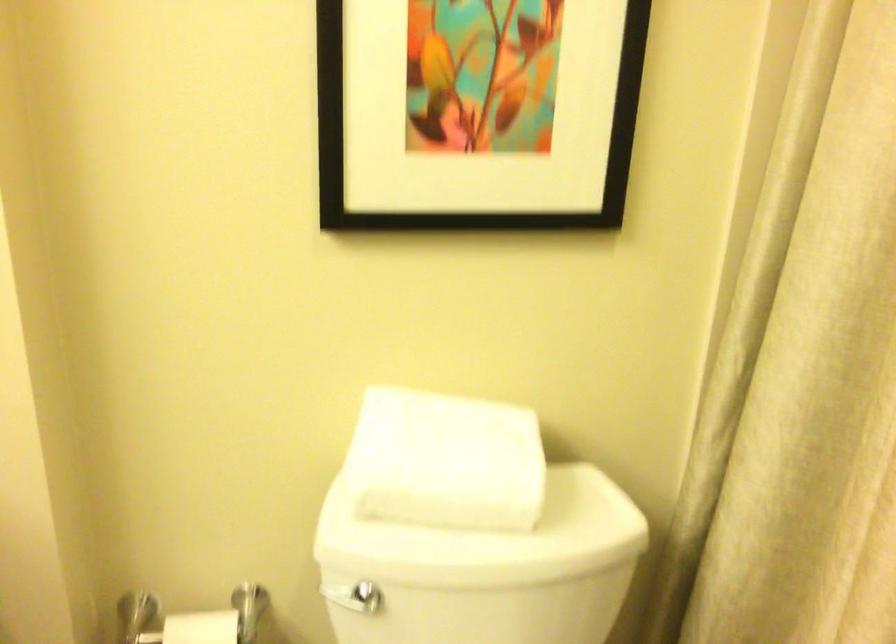
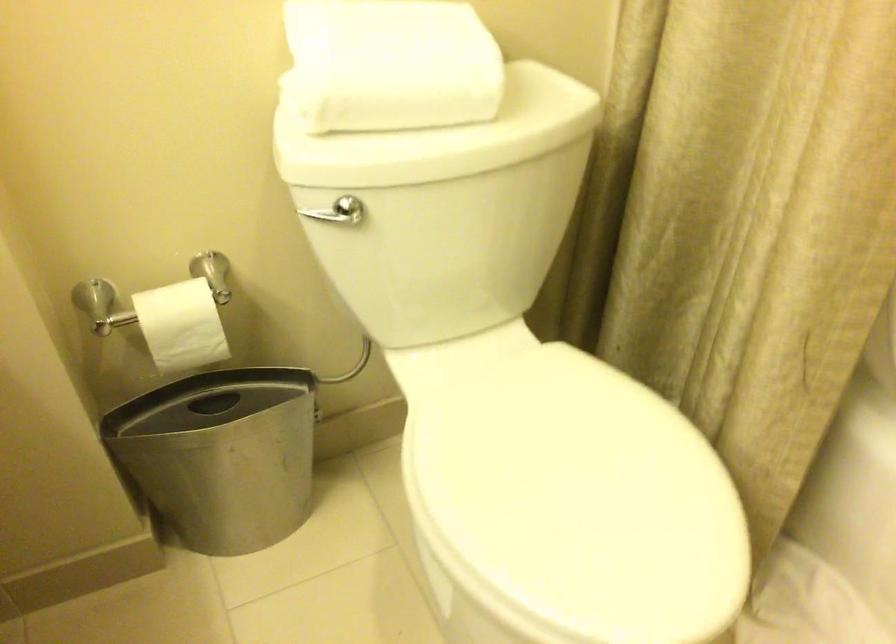
Question: Based on the continuous images, in which direction is the camera rotating? Reply with the corresponding letter.

Choices:
 (A) Left
 (B) Right
 (C) Up
 (D) Down

Answer: (D)